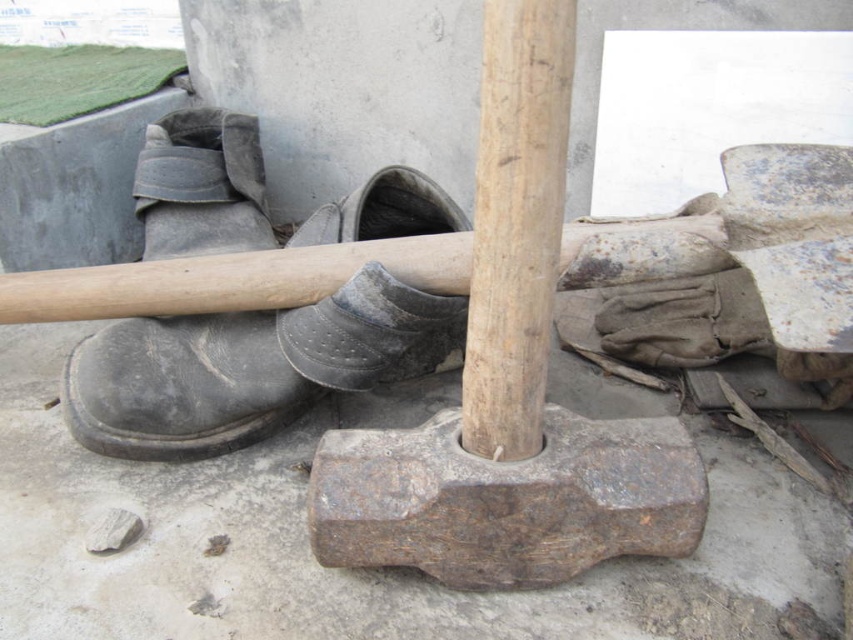
Question: Based on their relative distances, which object is farther from the rusty metal shovel at center?

Choices:
 (A) black leather boot at left
 (B) worn leather shoe at center

Answer: (A)

Question: Can you confirm if smooth wood pole at center is positioned to the left of worn leather shoe at center?

Choices:
 (A) yes
 (B) no

Answer: (B)

Question: Does rusty metal shovel at center appear under worn leather shoe at center?

Choices:
 (A) no
 (B) yes

Answer: (B)

Question: Among these points, which one is nearest to the camera?

Choices:
 (A) (231, 248)
 (B) (405, 321)
 (C) (514, 16)

Answer: (C)

Question: Which point is farther from the camera taking this photo?

Choices:
 (A) (465, 337)
 (B) (424, 365)
 (C) (509, 480)
 (D) (241, 429)

Answer: (B)

Question: Is black leather boot at left wider than smooth wood pole at center?

Choices:
 (A) no
 (B) yes

Answer: (B)